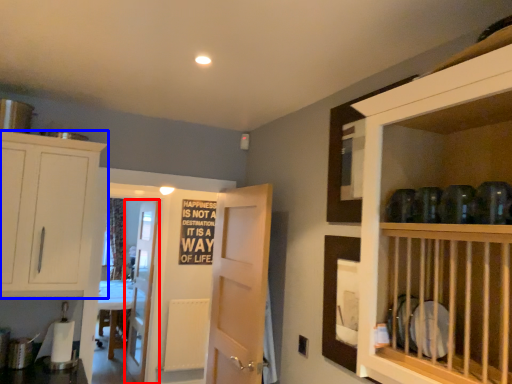
Question: Which point is further to the camera, door (highlighted by a red box) or cabinetry (highlighted by a blue box)?

Choices:
 (A) door
 (B) cabinetry

Answer: (A)